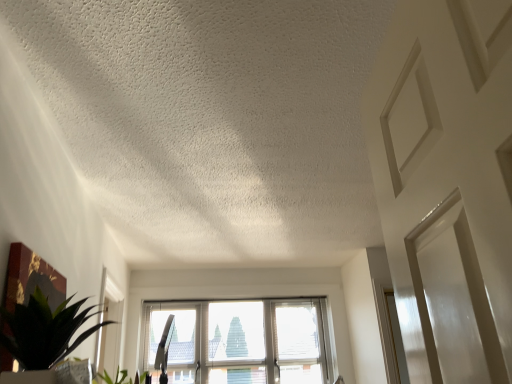
Question: In terms of height, does transparent glass window at center look taller or shorter compared to green leafy plant at lower left?

Choices:
 (A) short
 (B) tall

Answer: (B)

Question: Would you say transparent glass window at center is to the left or to the right of green leafy plant at lower left in the picture?

Choices:
 (A) left
 (B) right

Answer: (B)

Question: In terms of size, does transparent glass window at center appear bigger or smaller than green leafy plant at lower left?

Choices:
 (A) big
 (B) small

Answer: (A)

Question: Looking at their shapes, would you say green leafy plant at lower left is wider or thinner than transparent glass window at center?

Choices:
 (A) thin
 (B) wide

Answer: (B)

Question: Is green leafy plant at lower left inside or outside of transparent glass window at center?

Choices:
 (A) inside
 (B) outside

Answer: (B)

Question: From the image's perspective, relative to transparent glass window at center, is green leafy plant at lower left above or below?

Choices:
 (A) below
 (B) above

Answer: (B)

Question: Relative to transparent glass window at center, is green leafy plant at lower left in front or behind?

Choices:
 (A) behind
 (B) front

Answer: (B)